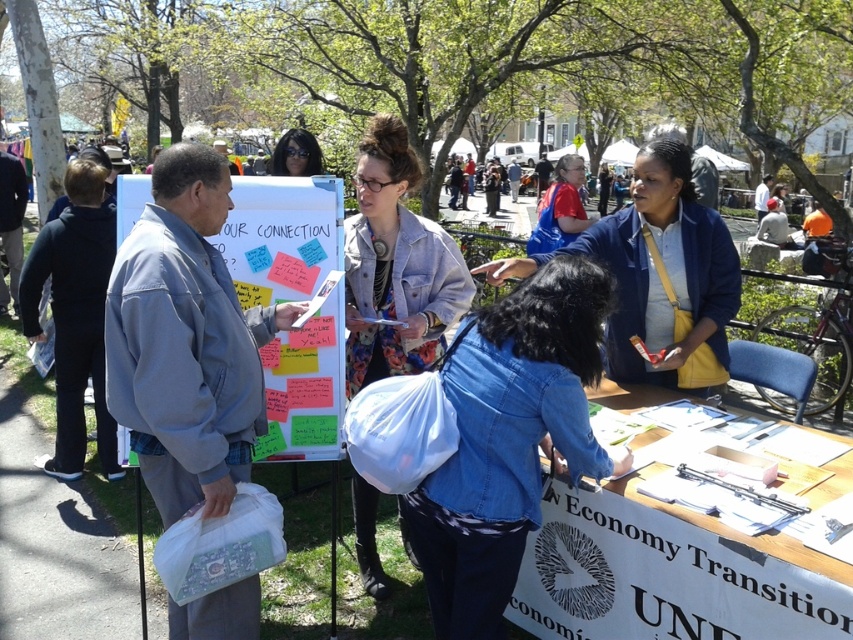
Describe the element at coordinates (186, 340) in the screenshot. I see `denim jacket at left` at that location.

The image size is (853, 640). I want to click on denim jacket at left, so pos(186,340).

Is denim jacket at left shorter than matte black hair at upper center?

No, denim jacket at left is not shorter than matte black hair at upper center.

Does denim jacket at left lie in front of matte black hair at upper center?

That is True.

Find the location of a particular element. Image resolution: width=853 pixels, height=640 pixels. denim jacket at left is located at coordinates (186, 340).

Describe the element at coordinates (668, 573) in the screenshot. Image resolution: width=853 pixels, height=640 pixels. I see `wooden table at lower center` at that location.

Who is lower down, wooden table at lower center or matte blue jacket at center?

Positioned lower is wooden table at lower center.

Which is in front, point (643, 420) or point (618, 227)?

Point (643, 420) is in front.

You are a GUI agent. You are given a task and a screenshot of the screen. Output one action in this format:
    pyautogui.click(x=<x>, y=<y>)
    Task: Click on the wooden table at lower center
    The width and height of the screenshot is (853, 640).
    Given the screenshot: What is the action you would take?
    pyautogui.click(x=668, y=573)